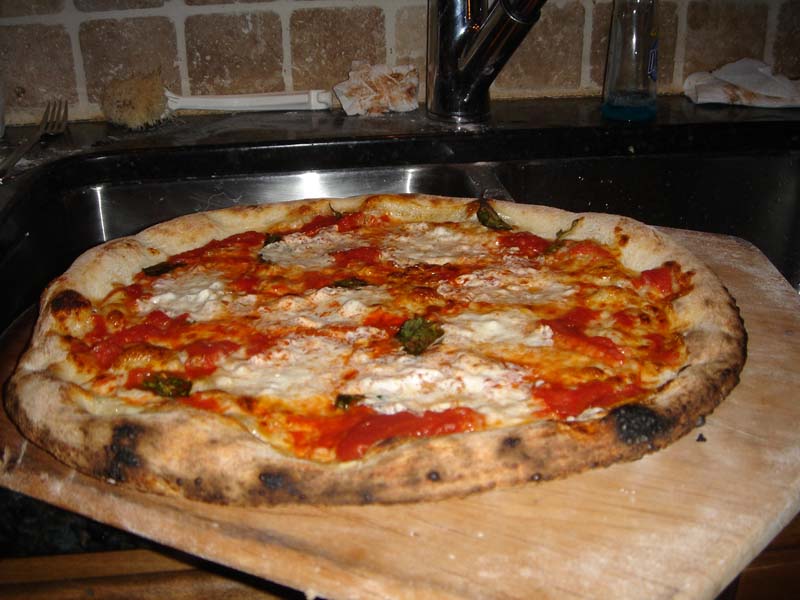
Identify the location of metal faucet of sink. The height and width of the screenshot is (600, 800). (504, 45).